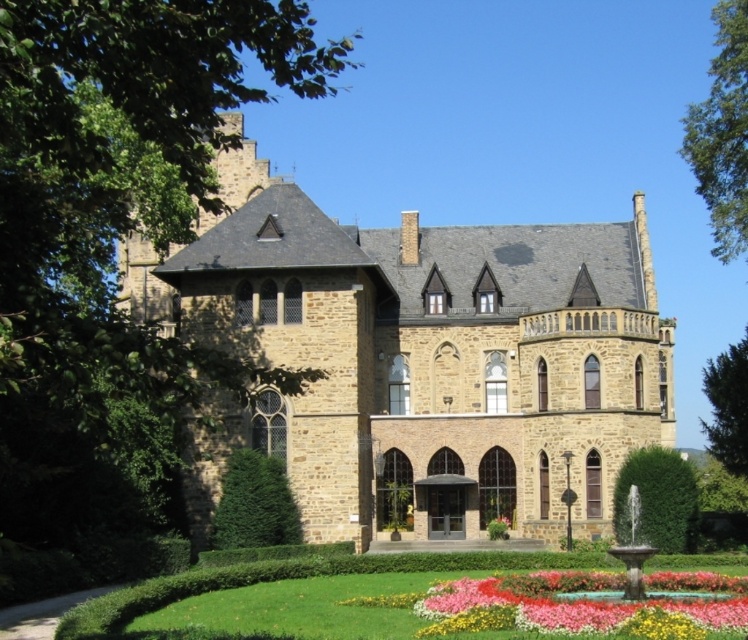
Question: Does stone mansion at center lie behind pink fabric flower at center?

Choices:
 (A) no
 (B) yes

Answer: (A)

Question: Which point is closer to the camera?

Choices:
 (A) (508, 525)
 (B) (674, 493)
 (C) (462, 410)

Answer: (B)

Question: Which is farther from the green leafy hedge at center?

Choices:
 (A) green grass at lower center
 (B) green leafy hedge at lower right

Answer: (B)

Question: Is vivid floral carpet at center behind green leafy hedge at lower right?

Choices:
 (A) yes
 (B) no

Answer: (B)

Question: Does green grass at lower center appear on the right side of green leafy hedge at lower right?

Choices:
 (A) no
 (B) yes

Answer: (A)

Question: Which object appears farthest from the camera in this image?

Choices:
 (A) green leafy hedge at lower right
 (B) green grass at lower center
 (C) green leafy hedge at center
 (D) pink fabric flower at center

Answer: (D)